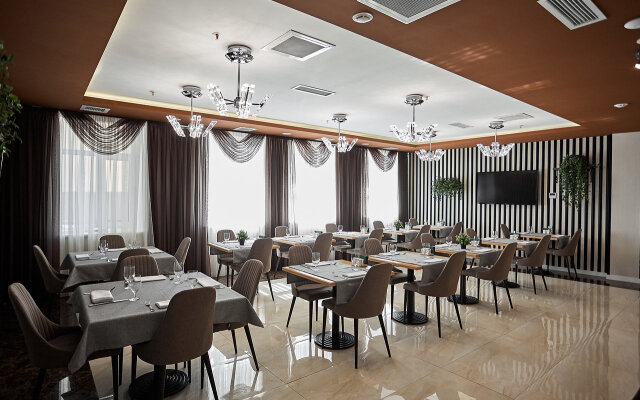
Locate an element on the screen. This screenshot has width=640, height=400. curtain window drapes is located at coordinates (118, 140), (237, 143), (384, 158), (312, 151).